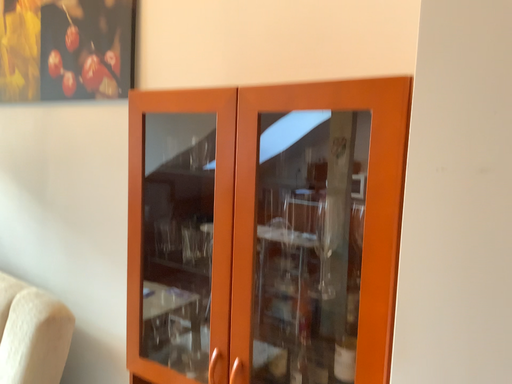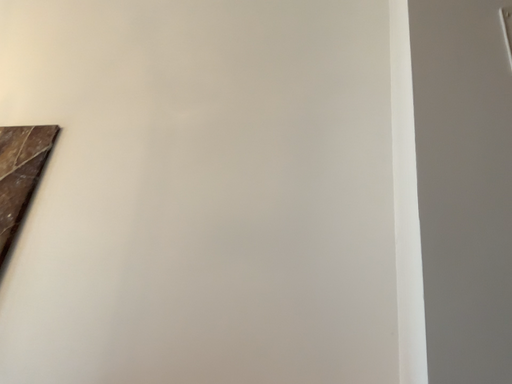
Question: How did the camera likely rotate when shooting the video?

Choices:
 (A) rotated left
 (B) rotated right

Answer: (B)